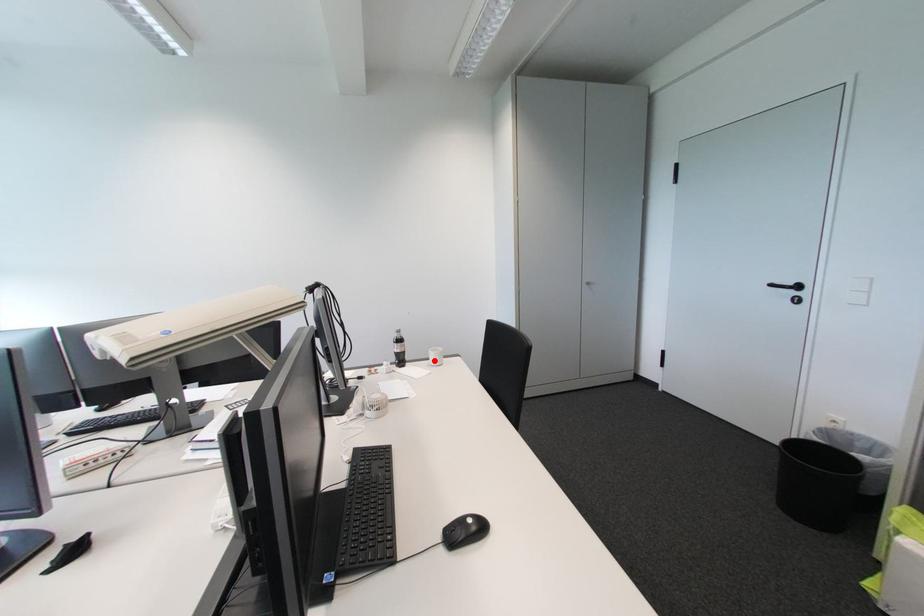
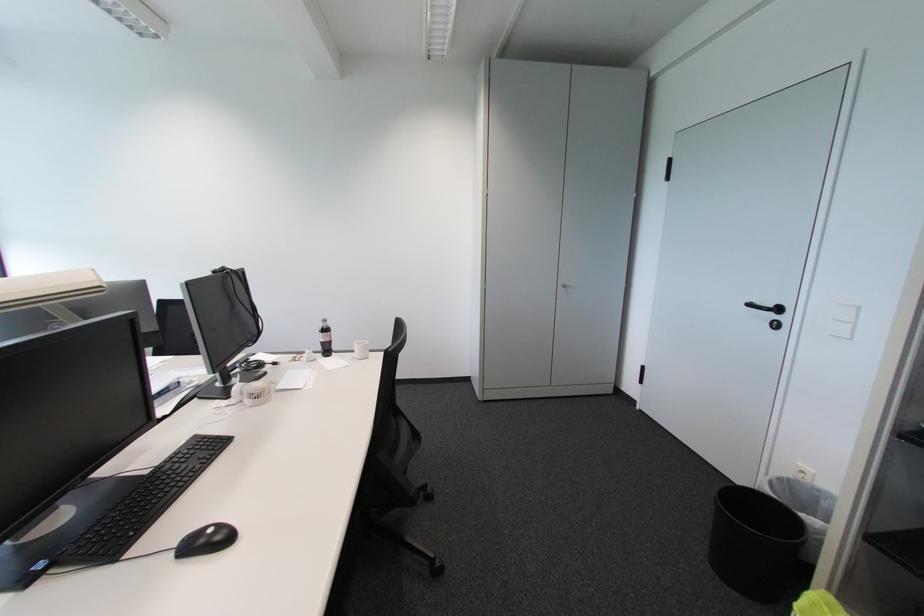
Where in the second image is the point corresponding to the highlighted location from the first image?

(359, 353)